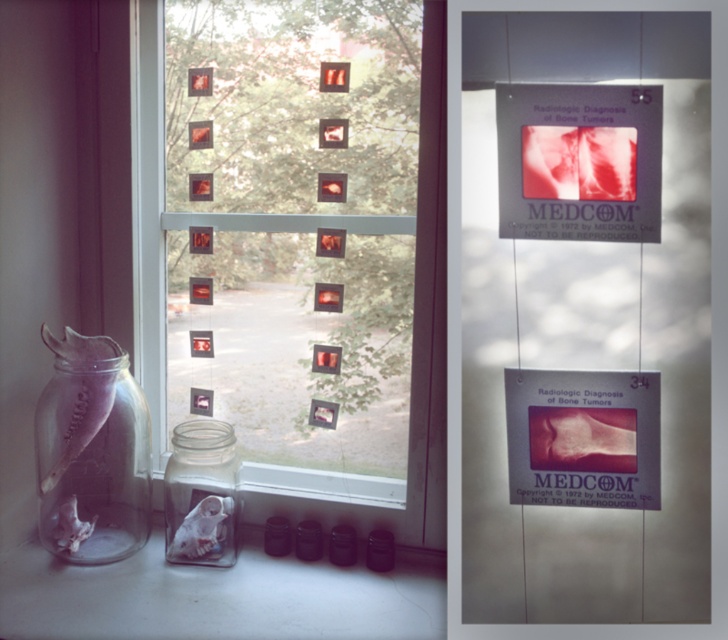
Question: Does matte paper poster at center lie in front of transparent glass window at center?

Choices:
 (A) yes
 (B) no

Answer: (A)

Question: Among these objects, which one is nearest to the camera?

Choices:
 (A) transparent glass window at center
 (B) matte paper poster at center
 (C) clear glass jar at left
 (D) matte plastic poster at upper right

Answer: (D)

Question: Which object is closer to the camera taking this photo?

Choices:
 (A) matte plastic poster at upper right
 (B) transparent glass window at center

Answer: (A)

Question: Does matte paper poster at center appear on the left side of transparent glass window at center?

Choices:
 (A) yes
 (B) no

Answer: (B)

Question: Estimate the real-world distances between objects in this image. Which object is closer to the clear glass jar at left?

Choices:
 (A) matte plastic poster at upper right
 (B) matte paper poster at center
 (C) transparent glass window at center

Answer: (C)

Question: Does matte gray paper at center have a smaller size compared to matte paper poster at center?

Choices:
 (A) no
 (B) yes

Answer: (A)